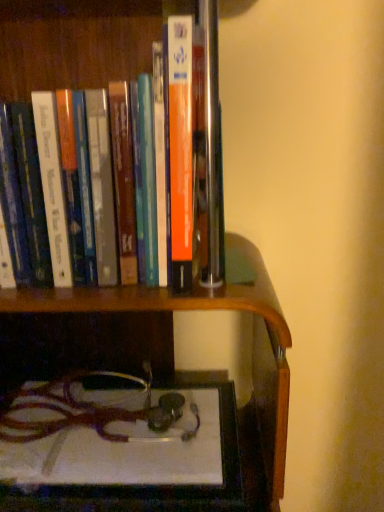
The image size is (384, 512). What do you see at coordinates (182, 310) in the screenshot? I see `white glossy book at lower center` at bounding box center [182, 310].

I want to click on white glossy book at lower center, so click(x=182, y=310).

Where is `orange matte book at upper center`? This screenshot has height=512, width=384. orange matte book at upper center is located at coordinates tap(74, 42).

What do you see at coordinates (74, 42) in the screenshot? Image resolution: width=384 pixels, height=512 pixels. I see `orange matte book at upper center` at bounding box center [74, 42].

The width and height of the screenshot is (384, 512). I want to click on white glossy book at lower center, so (x=182, y=310).

Which object is positioned more to the left, white glossy book at lower center or orange matte book at upper center?

orange matte book at upper center.

Is white glossy book at lower center closer to the viewer compared to orange matte book at upper center?

No, it is not.

Considering the positions of point (136, 311) and point (102, 12), is point (136, 311) closer or farther from the camera than point (102, 12)?

Point (136, 311).

From the image's perspective, which is below, white glossy book at lower center or orange matte book at upper center?

white glossy book at lower center, from the image's perspective.

From a real-world perspective, is white glossy book at lower center positioned above or below orange matte book at upper center?

white glossy book at lower center is situated lower than orange matte book at upper center in the real world.

In the scene shown: Does white glossy book at lower center have a lesser width compared to orange matte book at upper center?

No.

Can you confirm if white glossy book at lower center is taller than orange matte book at upper center?

In fact, white glossy book at lower center may be shorter than orange matte book at upper center.

Is white glossy book at lower center bigger than orange matte book at upper center?

No.

Would you say orange matte book at upper center is part of white glossy book at lower center's contents?

No, orange matte book at upper center is not inside white glossy book at lower center.

Consider the image. Is there a large distance between white glossy book at lower center and orange matte book at upper center?

No, white glossy book at lower center is in close proximity to orange matte book at upper center.

Does white glossy book at lower center turn towards orange matte book at upper center?

No, white glossy book at lower center is not turned towards orange matte book at upper center.

How different are the orientations of white glossy book at lower center and orange matte book at upper center in degrees?

They differ by 0.111 degrees in their facing directions.

Measure the distance from white glossy book at lower center to orange matte book at upper center.

white glossy book at lower center is 17.05 inches from orange matte book at upper center.

Locate an element on the screen. The image size is (384, 512). book on the left of the white glossy book at lower center is located at coordinates (74, 42).

Which object is positioned more to the right, orange matte book at upper center or white glossy book at lower center?

white glossy book at lower center is more to the right.

Is orange matte book at upper center in front of white glossy book at lower center?

Yes, orange matte book at upper center is closer to the viewer.

Does point (129, 18) come behind point (61, 302)?

Yes, point (129, 18) is farther from viewer.

From the image's perspective, is orange matte book at upper center above or below white glossy book at lower center?

orange matte book at upper center is above white glossy book at lower center.

From the picture: From a real-world perspective, is orange matte book at upper center physically located above or below white glossy book at lower center?

Clearly, from a real-world perspective, orange matte book at upper center is above white glossy book at lower center.

Is orange matte book at upper center thinner than white glossy book at lower center?

Indeed, orange matte book at upper center has a lesser width compared to white glossy book at lower center.

Does orange matte book at upper center have a greater height compared to white glossy book at lower center?

Correct, orange matte book at upper center is much taller as white glossy book at lower center.

Considering the relative sizes of orange matte book at upper center and white glossy book at lower center in the image provided, is orange matte book at upper center smaller than white glossy book at lower center?

Actually, orange matte book at upper center might be larger than white glossy book at lower center.

Is orange matte book at upper center inside or outside of white glossy book at lower center?

orange matte book at upper center is spatially situated outside white glossy book at lower center.

Is orange matte book at upper center with white glossy book at lower center?

No, orange matte book at upper center is not in contact with white glossy book at lower center.

Is white glossy book at lower center at the back of orange matte book at upper center?

orange matte book at upper center is not turned away from white glossy book at lower center.

What's the angular difference between orange matte book at upper center and white glossy book at lower center's facing directions?

The facing directions of orange matte book at upper center and white glossy book at lower center are 0.111 degrees apart.

The image size is (384, 512). I want to click on book in front of the white glossy book at lower center, so click(74, 42).

There is a white glossy book at lower center. Where is `book above it (from a real-world perspective)`? This screenshot has height=512, width=384. book above it (from a real-world perspective) is located at coordinates (74, 42).

At what (x,y) coordinates should I click in order to perform the action: click on shelf below the orange matte book at upper center (from the image's perspective). Please return your answer as a coordinate pair (x, y). Image resolution: width=384 pixels, height=512 pixels. Looking at the image, I should click on (182, 310).